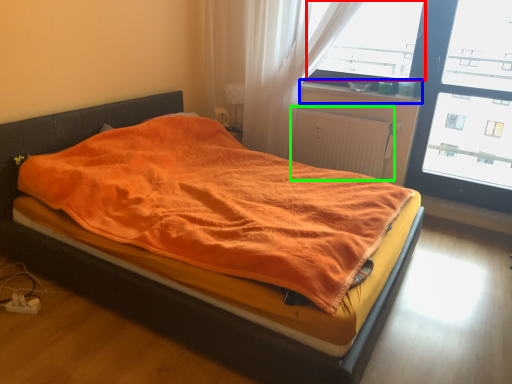
Question: Which is farther away from window screen (highlighted by a red box)? window sill (highlighted by a blue box) or radiator (highlighted by a green box)?

Choices:
 (A) window sill
 (B) radiator

Answer: (B)